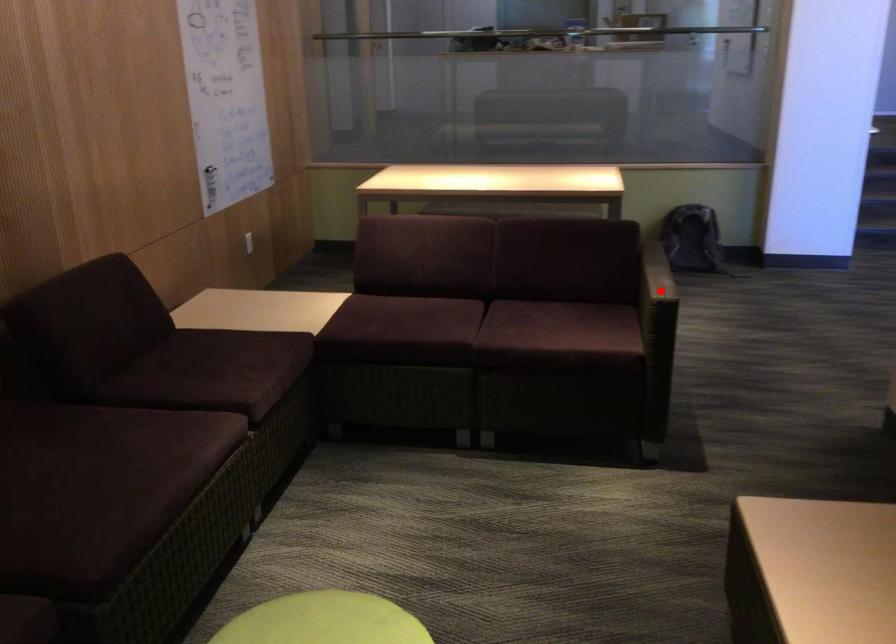
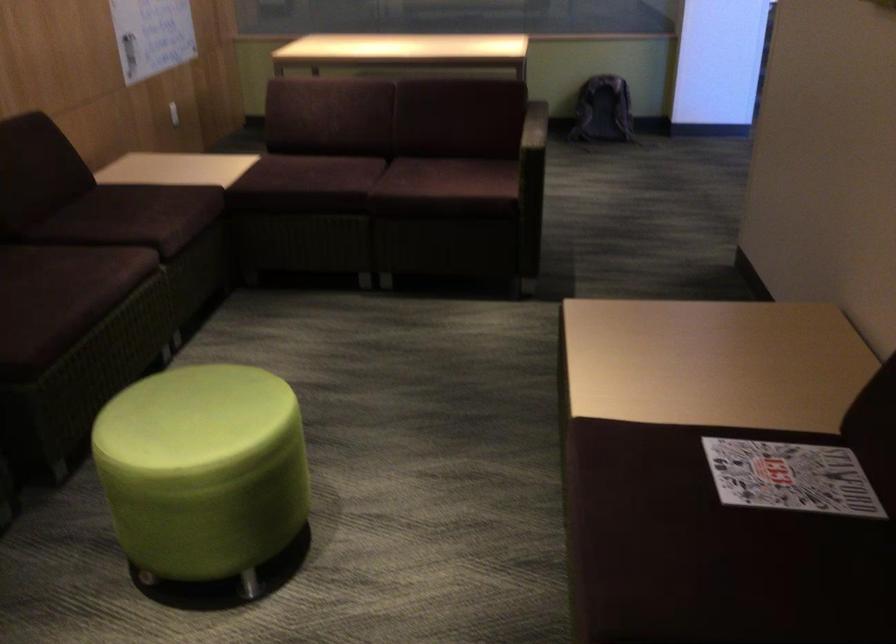
Locate, in the second image, the point that corresponds to the highlighted location in the first image.

(533, 138)